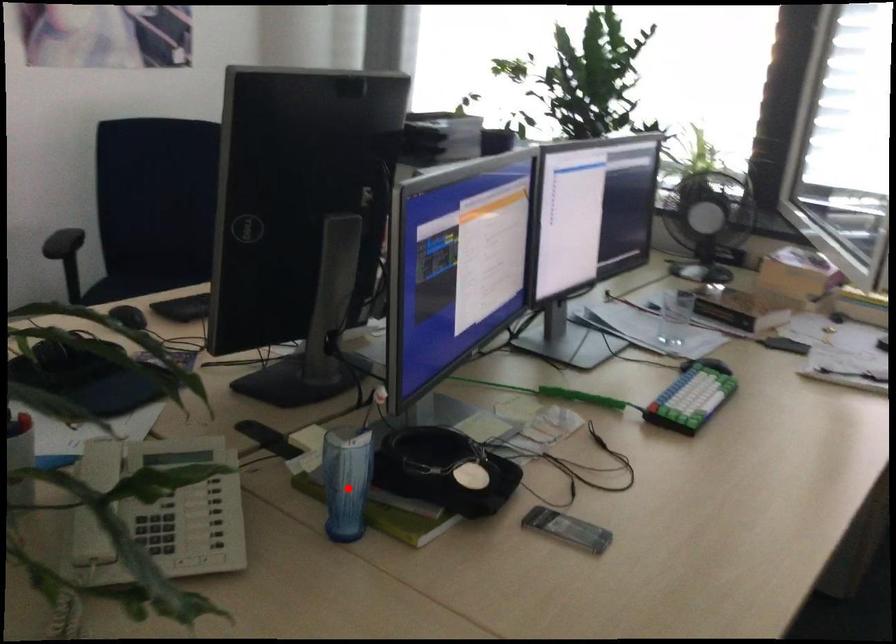
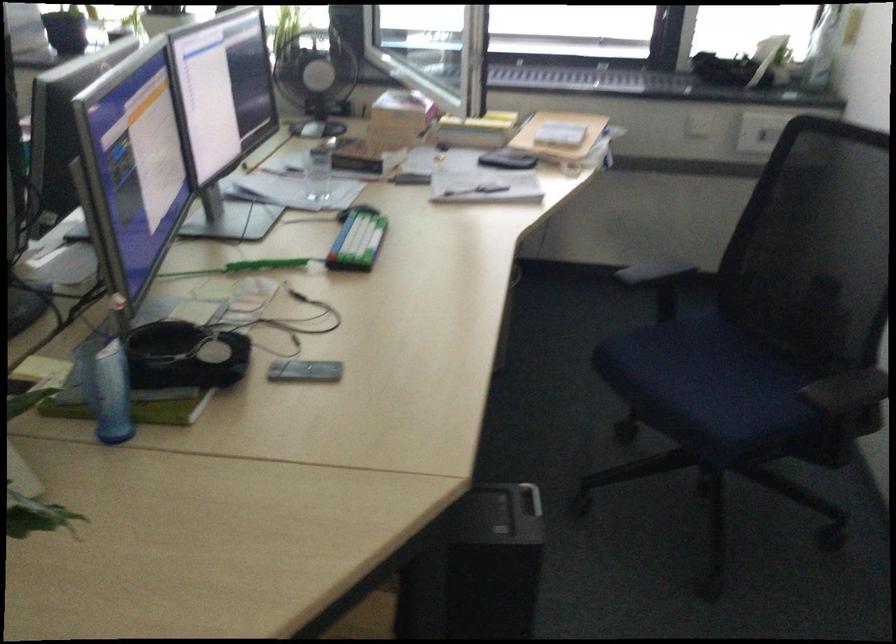
Find the pixel in the second image that matches the highlighted location in the first image.

(110, 393)